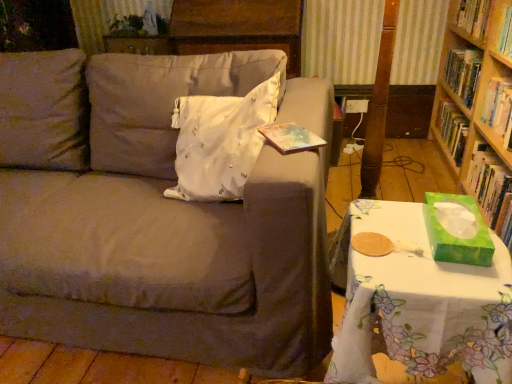
Question: Is green matte tissue box at right, placed as the first book when sorted from bottom to top, located within white floral tablecloth at lower right?

Choices:
 (A) no
 (B) yes

Answer: (A)

Question: Is white floral tablecloth at lower right at the right side of green matte tissue box at right, which is the third book in top-to-bottom order?

Choices:
 (A) no
 (B) yes

Answer: (A)

Question: Is white floral tablecloth at lower right positioned behind green matte tissue box at right, which is the third book in top-to-bottom order?

Choices:
 (A) yes
 (B) no

Answer: (B)

Question: Considering the relative sizes of white floral tablecloth at lower right and green matte tissue box at right, placed as the first book when sorted from bottom to top, in the image provided, is white floral tablecloth at lower right thinner than green matte tissue box at right, placed as the first book when sorted from bottom to top,?

Choices:
 (A) yes
 (B) no

Answer: (B)

Question: Can you confirm if white floral tablecloth at lower right is bigger than green matte tissue box at right, which is the third book in top-to-bottom order?

Choices:
 (A) yes
 (B) no

Answer: (A)

Question: Do you think hardcover book at upper right, the 2th book positioned from the bottom, is within green matte tissue box at right, which is the third book in top-to-bottom order, or outside of it?

Choices:
 (A) inside
 (B) outside

Answer: (B)

Question: Looking at the image, does hardcover book at upper right, the 2th book when ordered from top to bottom, seem bigger or smaller compared to green matte tissue box at right, placed as the first book when sorted from bottom to top?

Choices:
 (A) big
 (B) small

Answer: (B)

Question: Is point (510, 144) closer or farther from the camera than point (480, 162)?

Choices:
 (A) closer
 (B) farther

Answer: (A)

Question: Is hardcover book at upper right, the 2th book positioned from the bottom, in front of or behind green matte tissue box at right, which is the third book in top-to-bottom order, in the image?

Choices:
 (A) behind
 (B) front

Answer: (A)

Question: Looking at the image, does green matte tissue box at right, which is the third book in top-to-bottom order, seem bigger or smaller compared to matte gray couch at center?

Choices:
 (A) big
 (B) small

Answer: (B)

Question: In the image, is green matte tissue box at right, placed as the first book when sorted from bottom to top, positioned in front of or behind matte gray couch at center?

Choices:
 (A) front
 (B) behind

Answer: (B)

Question: From the image's perspective, is green matte tissue box at right, placed as the first book when sorted from bottom to top, above or below matte gray couch at center?

Choices:
 (A) above
 (B) below

Answer: (B)

Question: Is green matte tissue box at right, which is the third book in top-to-bottom order, wider or thinner than matte gray couch at center?

Choices:
 (A) wide
 (B) thin

Answer: (B)

Question: Looking at their shapes, would you say white satin pillow at center is wider or thinner than hardcover book at upper right, the 2th book positioned from the bottom?

Choices:
 (A) thin
 (B) wide

Answer: (B)

Question: In the image, is white satin pillow at center positioned in front of or behind hardcover book at upper right, the 2th book when ordered from top to bottom?

Choices:
 (A) behind
 (B) front

Answer: (B)